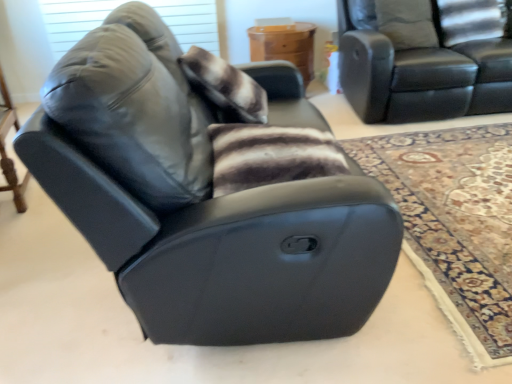
In order to click on brown fur blanket at center in this screenshot , I will do `click(271, 155)`.

The height and width of the screenshot is (384, 512). I want to click on fuzzy brown pillow at upper center, so click(x=225, y=87).

This screenshot has width=512, height=384. In order to click on black leather couch at upper right in this screenshot , I will do `click(424, 59)`.

Find the location of a particular element. The height and width of the screenshot is (384, 512). black leather recliner at center is located at coordinates (199, 203).

The height and width of the screenshot is (384, 512). Describe the element at coordinates (199, 203) in the screenshot. I see `black leather recliner at center` at that location.

Identify the location of matte gray window screen at upper left. (73, 20).

Locate an element on the screen. The image size is (512, 384). carpeted rug at lower right is located at coordinates (455, 223).

You are a GUI agent. You are given a task and a screenshot of the screen. Output one action in this format:
    pyautogui.click(x=<x>, y=<y>)
    Task: Click on the wooden table at left, arranged as the first table when viewed from the front
    
    Given the screenshot: What is the action you would take?
    pyautogui.click(x=5, y=149)

Considering the positions of objects matte gray window screen at upper left and fuzzy brown pillow at upper center in the image provided, who is more to the left, matte gray window screen at upper left or fuzzy brown pillow at upper center?

matte gray window screen at upper left is more to the left.

From the image's perspective, which object appears higher, matte gray window screen at upper left or fuzzy brown pillow at upper center?

matte gray window screen at upper left is shown above in the image.

Considering the positions of point (74, 23) and point (236, 92), is point (74, 23) closer or farther from the camera than point (236, 92)?

Clearly, point (74, 23) is more distant from the camera than point (236, 92).

Can you see fuzzy brown pillow at upper center touching carpeted rug at lower right?

fuzzy brown pillow at upper center and carpeted rug at lower right are not in contact.

From a real-world perspective, is fuzzy brown pillow at upper center positioned under carpeted rug at lower right based on gravity?

No, from a real-world perspective, fuzzy brown pillow at upper center is not beneath carpeted rug at lower right.

Consider the image. How different are the orientations of fuzzy brown pillow at upper center and carpeted rug at lower right in degrees?

They differ by 179 degrees in their facing directions.

From the image's perspective, between fuzzy brown pillow at upper center and carpeted rug at lower right, who is located below?

carpeted rug at lower right.

In terms of width, does wooden table at center, the 1th table from the right, look wider or thinner when compared to wooden table at left, the 1th table positioned from the bottom?

Clearly, wooden table at center, the 1th table from the right, has less width compared to wooden table at left, the 1th table positioned from the bottom.

Which of these two, wooden table at center, the first table from the back, or wooden table at left, the second table positioned from the back, is bigger?

Bigger between the two is wooden table at left, the second table positioned from the back.

Considering the positions of objects wooden table at center, arranged as the 1th table when viewed from the top, and wooden table at left, the 1th table positioned from the bottom, in the image provided, who is behind, wooden table at center, arranged as the 1th table when viewed from the top, or wooden table at left, the 1th table positioned from the bottom,?

wooden table at center, arranged as the 1th table when viewed from the top, is further from the camera.

Where is `table above the wooden table at left, the first table when ordered from left to right (from the image's perspective)`? table above the wooden table at left, the first table when ordered from left to right (from the image's perspective) is located at coordinates (284, 44).

Where is `blanket above the wooden table at left, the 1th table positioned from the bottom (from a real-world perspective)`? The height and width of the screenshot is (384, 512). blanket above the wooden table at left, the 1th table positioned from the bottom (from a real-world perspective) is located at coordinates (271, 155).

Which object is thinner, wooden table at left, the 1th table positioned from the bottom, or brown fur blanket at center?

brown fur blanket at center.

Looking at this image, how many degrees apart are the facing directions of wooden table at left, the 1th table positioned from the bottom, and brown fur blanket at center?

There is a 81.4-degree angle between the facing directions of wooden table at left, the 1th table positioned from the bottom, and brown fur blanket at center.

From the image's perspective, does wooden table at left, the first table when ordered from left to right, appear higher than brown fur blanket at center?

Yes, from the image's perspective, wooden table at left, the first table when ordered from left to right, is on top of brown fur blanket at center.

Is black leather couch at upper right turned away from fuzzy brown pillow at upper center?

No, black leather couch at upper right is not facing the opposite direction of fuzzy brown pillow at upper center.

Which object is wider, black leather couch at upper right or fuzzy brown pillow at upper center?

With larger width is black leather couch at upper right.

Where is `studio couch on the right of fuzzy brown pillow at upper center`? This screenshot has width=512, height=384. studio couch on the right of fuzzy brown pillow at upper center is located at coordinates (424, 59).

Can you confirm if black leather couch at upper right is taller than fuzzy brown pillow at upper center?

Indeed, black leather couch at upper right has a greater height compared to fuzzy brown pillow at upper center.

Is point (360, 67) positioned before point (332, 155)?

No, (360, 67) is further to viewer.

Could you tell me if black leather couch at upper right is facing brown fur blanket at center?

No, black leather couch at upper right is not turned towards brown fur blanket at center.

Would you say black leather couch at upper right contains brown fur blanket at center?

No, brown fur blanket at center is located outside of black leather couch at upper right.

Which point is more forward, (390, 169) or (2, 126)?

The point (2, 126) is closer.

How much distance is there between carpeted rug at lower right and wooden table at left, which appears as the 2th table when viewed from the right?

carpeted rug at lower right and wooden table at left, which appears as the 2th table when viewed from the right, are 7.31 feet apart from each other.

Is carpeted rug at lower right wider or thinner than wooden table at left, the first table when ordered from left to right?

Clearly, carpeted rug at lower right has more width compared to wooden table at left, the first table when ordered from left to right.

Where is `mat below the wooden table at left, the 1th table positioned from the bottom (from a real-world perspective)`? mat below the wooden table at left, the 1th table positioned from the bottom (from a real-world perspective) is located at coordinates (455, 223).

Where is `window screen behind the fuzzy brown pillow at upper center`? The image size is (512, 384). window screen behind the fuzzy brown pillow at upper center is located at coordinates (73, 20).

The width and height of the screenshot is (512, 384). I want to click on mat in front of the fuzzy brown pillow at upper center, so click(x=455, y=223).

Based on their spatial positions, is wooden table at center, arranged as the 1th table when viewed from the top, or wooden table at left, arranged as the first table when viewed from the front, closer to black leather couch at upper right?

wooden table at center, arranged as the 1th table when viewed from the top, lies closer to black leather couch at upper right than the other object.

When comparing their distances from wooden table at center, the first table from the back, does matte gray window screen at upper left or carpeted rug at lower right seem further?

carpeted rug at lower right.

Considering their positions, is brown fur blanket at center positioned closer to black leather recliner at center than carpeted rug at lower right?

brown fur blanket at center is closer to black leather recliner at center.

Based on their spatial positions, is carpeted rug at lower right or fuzzy brown pillow at upper center closer to matte gray window screen at upper left?

The object closer to matte gray window screen at upper left is fuzzy brown pillow at upper center.

Looking at the image, which one is located closer to wooden table at center, the second table positioned from the left, black leather recliner at center or black leather couch at upper right?

black leather couch at upper right is positioned closer to the anchor wooden table at center, the second table positioned from the left.

Which object lies further to the anchor point wooden table at center, which appears as the second table when ordered from the bottom, fuzzy brown pillow at upper center or black leather recliner at center?

Based on the image, black leather recliner at center appears to be further to wooden table at center, which appears as the second table when ordered from the bottom.

Which object lies further to the anchor point brown fur blanket at center, matte gray window screen at upper left or wooden table at center, which appears as the second table when ordered from the bottom?

matte gray window screen at upper left lies further to brown fur blanket at center than the other object.

From the image, which object appears to be nearer to wooden table at left, the 1th table positioned from the bottom, brown fur blanket at center or fuzzy brown pillow at upper center?

fuzzy brown pillow at upper center.

Identify the location of pillow between wooden table at left, the second table positioned from the back, and carpeted rug at lower right. (225, 87).

Where is `blanket between black leather recliner at center and carpeted rug at lower right from left to right`? This screenshot has width=512, height=384. blanket between black leather recliner at center and carpeted rug at lower right from left to right is located at coordinates (271, 155).

Identify the location of window screen between wooden table at left, the 1th table positioned from the bottom, and carpeted rug at lower right from left to right. The width and height of the screenshot is (512, 384). (73, 20).

This screenshot has height=384, width=512. Find the location of `mat between brown fur blanket at center and matte gray window screen at upper left along the z-axis`. mat between brown fur blanket at center and matte gray window screen at upper left along the z-axis is located at coordinates (455, 223).